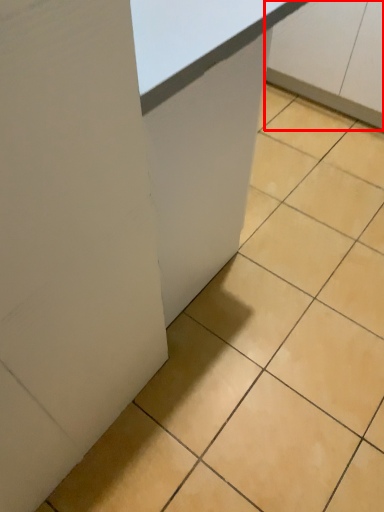
Question: In this image, where is cabinetry (annotated by the red box) located relative to table?

Choices:
 (A) left
 (B) right

Answer: (B)